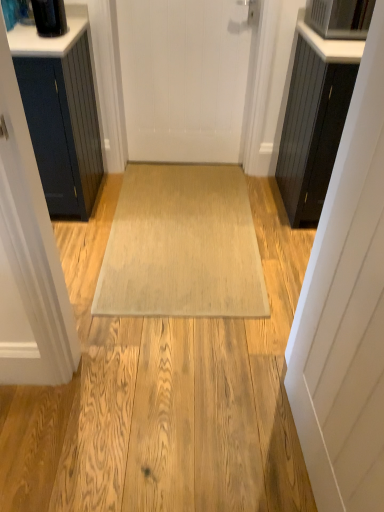
Find the location of a particular element. The image size is (384, 512). free spot below black glossy container at upper left (from a real-world perspective) is located at coordinates (91, 194).